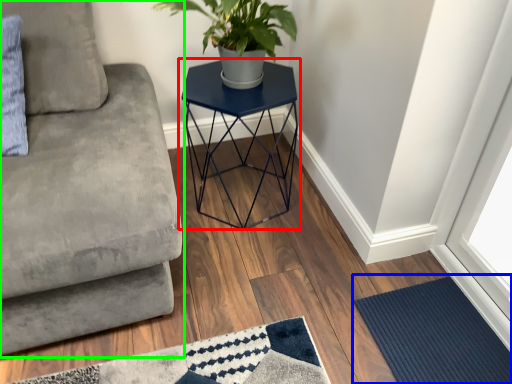
Question: Which object is the farthest from table (highlighted by a red box)? Choose among these: doormat (highlighted by a blue box) or studio couch (highlighted by a green box).

Choices:
 (A) doormat
 (B) studio couch

Answer: (A)